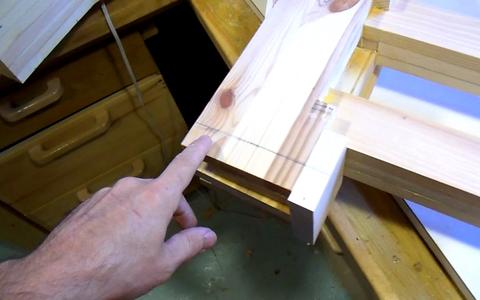
Find the location of a particular element. The image size is (480, 300). table is located at coordinates (376, 228).